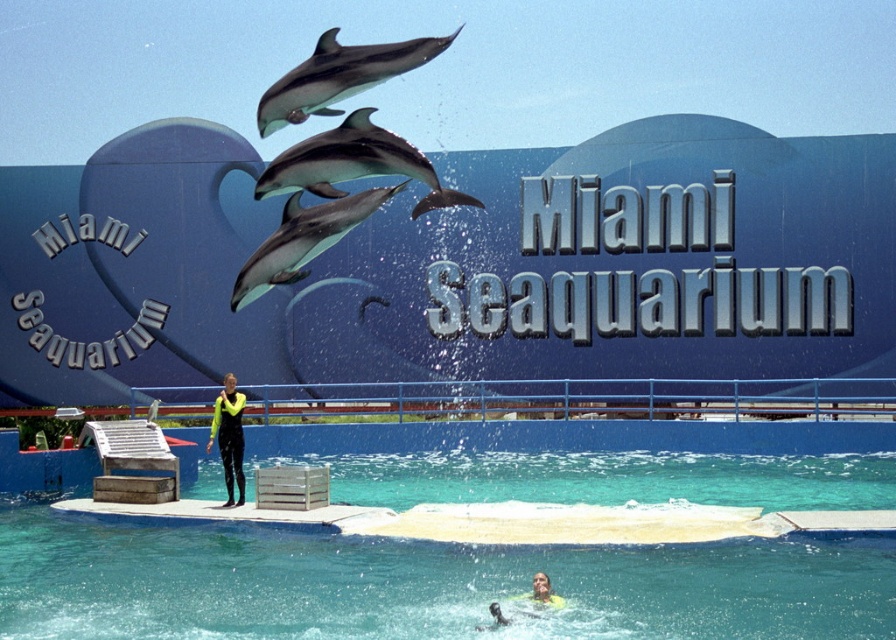
Which is below, clear blue water at center or neon yellow wetsuit at center?

clear blue water at center is lower down.

Based on the photo, does clear blue water at center have a lesser height compared to neon yellow wetsuit at center?

Indeed, clear blue water at center has a lesser height compared to neon yellow wetsuit at center.

Which is in front, point (444, 592) or point (228, 419)?

Positioned in front is point (444, 592).

Locate an element on the screen. The image size is (896, 640). clear blue water at center is located at coordinates (420, 586).

Between light gray smooth dolphin at center and neon yellow wetsuit at center, which one is positioned higher?

light gray smooth dolphin at center is above.

Between light gray smooth dolphin at center and neon yellow wetsuit at center, which one has less height?

light gray smooth dolphin at center is shorter.

Does point (354, 147) come closer to viewer compared to point (224, 422)?

Yes, point (354, 147) is closer to viewer.

Locate an element on the screen. The width and height of the screenshot is (896, 640). light gray smooth dolphin at center is located at coordinates (354, 164).

Where is `smooth gray dolphin at center`? The height and width of the screenshot is (640, 896). smooth gray dolphin at center is located at coordinates (302, 241).

Is smooth gray dolphin at center closer to the viewer compared to neon yellow wetsuit at center?

That is True.

Does point (274, 273) come closer to viewer compared to point (231, 474)?

Yes, point (274, 273) is in front of point (231, 474).

I want to click on smooth gray dolphin at center, so click(302, 241).